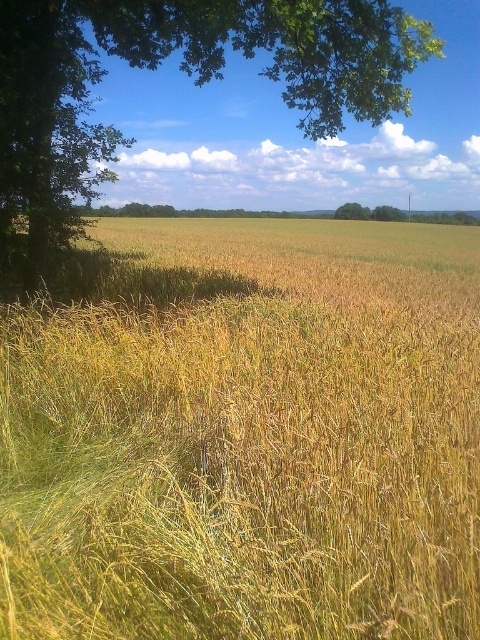
You are standing in the middle of the wheat field and see two points in the scene. The first point is at coordinates point (315, 589) and the second is at point (109, 35). Which point is closer to you?

Point (315, 589) is closer to the viewer than point (109, 35).

You are standing in the middle of the wheat field and want to reach the tree for shade. Which direction should you walk to get to the green leafy tree at upper left from the yellow grass at center?

The green leafy tree at upper left is located to the left side of the frame, so you should walk towards the left direction from the yellow grass at center to reach it.

You are standing in the middle of a golden wheat field and see a yellow grass at center marked by point (245, 435). If you want to walk towards the dense cluster of trees with lush green foliage on the left side of the frame, should you walk towards the yellow grass at center or away from it?

You should walk away from the yellow grass at center marked by point (245, 435) because the dense cluster of trees with lush green foliage is on the left side of the frame, opposite to the center where the grass is located.